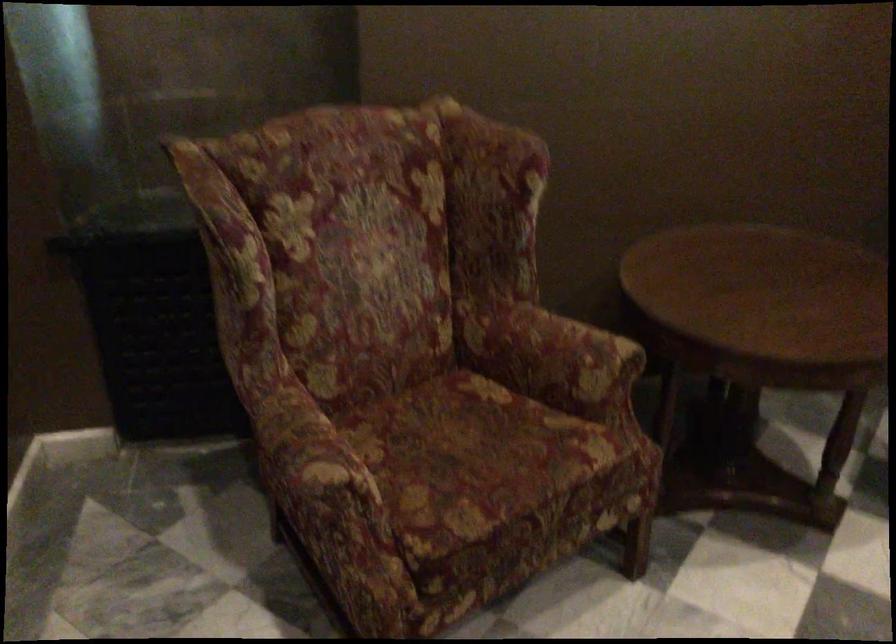
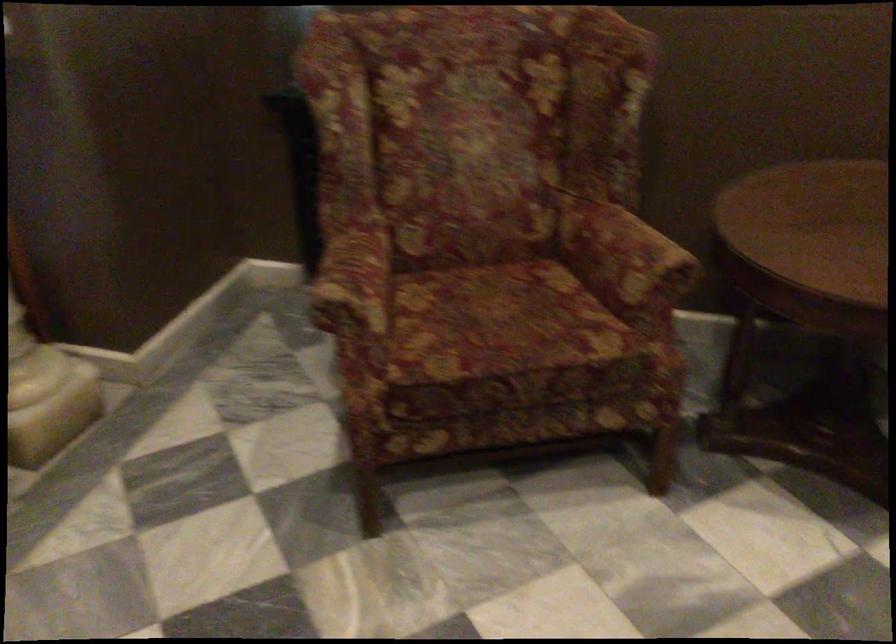
The point at (570, 357) is marked in the first image. Where is the corresponding point in the second image?

(624, 258)